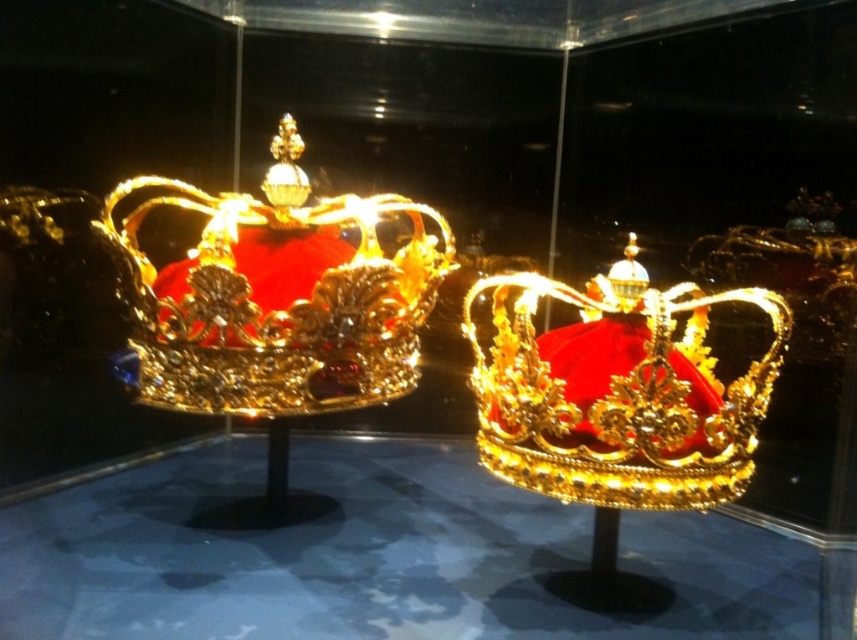
Question: Among these points, which one is nearest to the camera?

Choices:
 (A) (300, 204)
 (B) (150, 486)
 (C) (784, 332)

Answer: (C)

Question: Can you confirm if transparent glass table at center is positioned above gold shiny crown at center?

Choices:
 (A) no
 (B) yes

Answer: (A)

Question: Is transparent glass table at center closer to the viewer compared to gold/golden metallic crown at left?

Choices:
 (A) no
 (B) yes

Answer: (B)

Question: Which is nearer to the transparent glass table at center?

Choices:
 (A) gold/golden metallic crown at left
 (B) gold shiny crown at center

Answer: (B)

Question: Does transparent glass table at center have a greater width compared to gold/golden metallic crown at left?

Choices:
 (A) yes
 (B) no

Answer: (A)

Question: Estimate the real-world distances between objects in this image. Which object is closer to the gold shiny crown at center?

Choices:
 (A) gold/golden metallic crown at left
 (B) transparent glass table at center

Answer: (A)